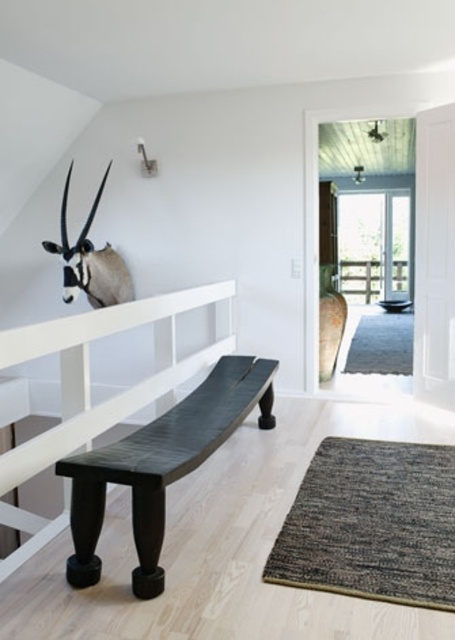
You are a painter who needs to place a 1.8 meter tall ladder in the hallway. The ladder must be placed between the dark wood bench at center and the white matte antelope head at upper left. Can the ladder fit vertically between them without touching either object?

The dark wood bench at center is not as tall as the white matte antelope head at upper left, but the exact heights are not provided. However, since the ladder is 1.8 meters tall, it may not fit vertically between them if the antelope head is positioned higher than the bench. Without specific measurements, it is uncertain if there is enough vertical space.

You are standing in the hallway and want to sit on the dark wood bench at center. Which direction should you move relative to the white matte antelope head at upper left?

The dark wood bench at center is to the right of the white matte antelope head at upper left, so you should move to the right of the white matte antelope head at upper left to reach the dark wood bench at center.

You are an interior designer assessing the hallway layout. The dark wood bench at center is currently positioned below the white matte antelope head at upper left. Is the bench placed in a location that aligns with standard ergonomic guidelines for seating placement relative to wall decor?

The dark wood bench at center is below the white matte antelope head at upper left, which may not align with standard ergonomic guidelines as the bench is directly under the antlered decor, potentially causing discomfort or safety hazards when sitting.